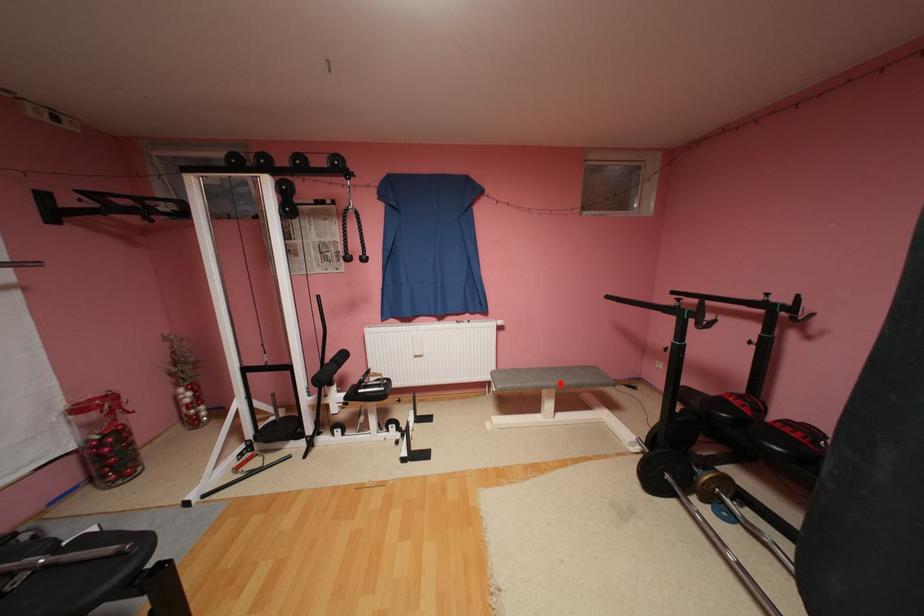
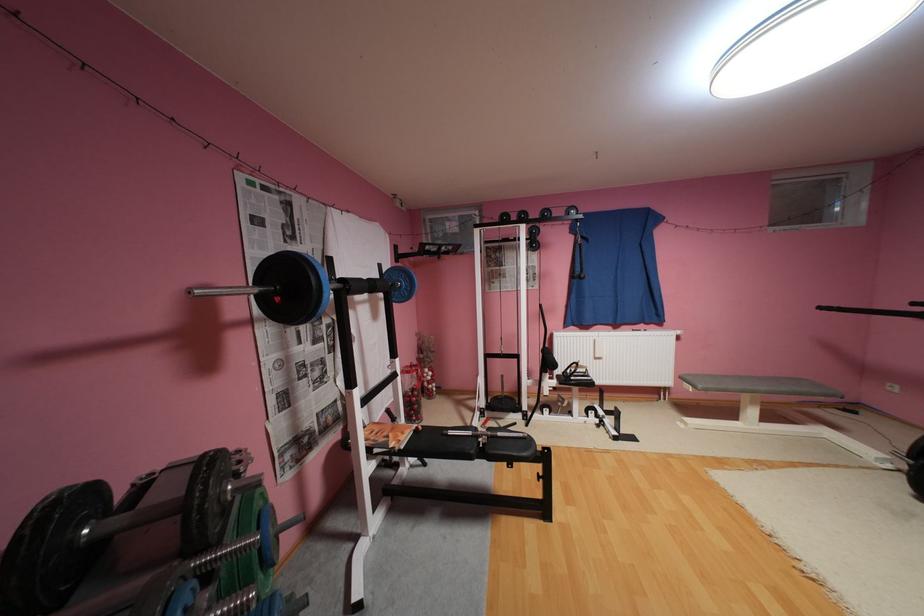
In the second image, find the point that corresponds to the highlighted location in the first image.

(771, 387)